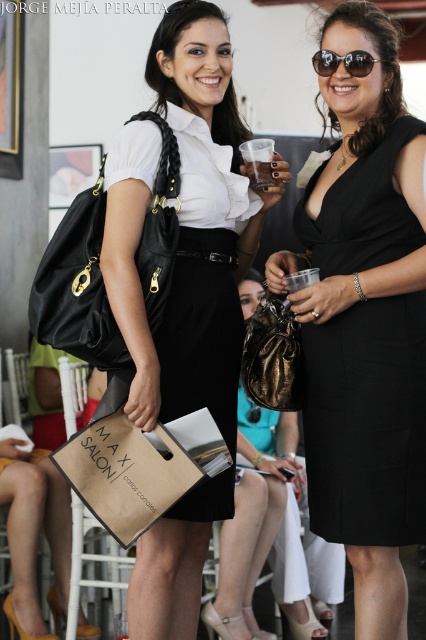
Does black leather bag at left appear over bronze metallic bag at center?

Yes, black leather bag at left is above bronze metallic bag at center.

Which is behind, point (58, 228) or point (279, 355)?

The point (279, 355) is behind.

At what (x,y) coordinates should I click in order to perform the action: click on black leather bag at left. Please return your answer as a coordinate pair (x, y). The width and height of the screenshot is (426, 640). Looking at the image, I should click on (77, 288).

Is black matte dress at center taller than black reflective sunglasses at upper center?

Correct, black matte dress at center is much taller as black reflective sunglasses at upper center.

Who is positioned more to the left, black matte dress at center or black reflective sunglasses at upper center?

From the viewer's perspective, black reflective sunglasses at upper center appears more on the left side.

This screenshot has width=426, height=640. Identify the location of black matte dress at center. (367, 420).

Measure the distance from black matte dress at center to black leather bag at left.

black matte dress at center is 30.20 inches from black leather bag at left.

Is point (386, 260) in front of point (83, 193)?

Yes, it is.

Image resolution: width=426 pixels, height=640 pixels. Identify the location of black matte dress at center. (367, 420).